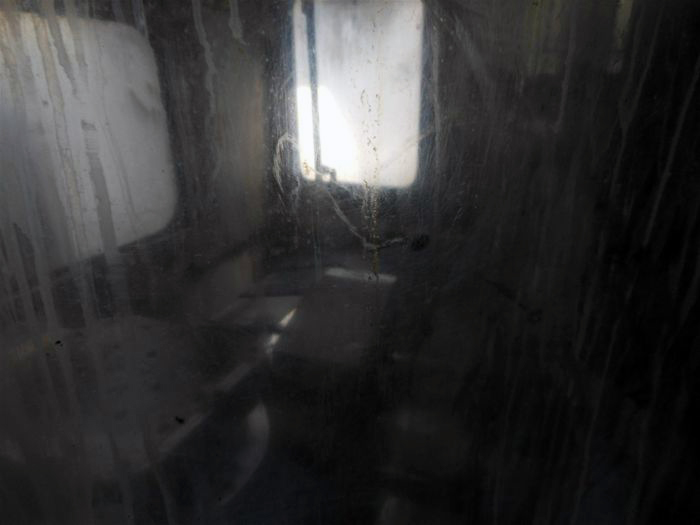
Find the location of a particular element. This screenshot has height=525, width=700. window is located at coordinates (98, 153), (356, 73).